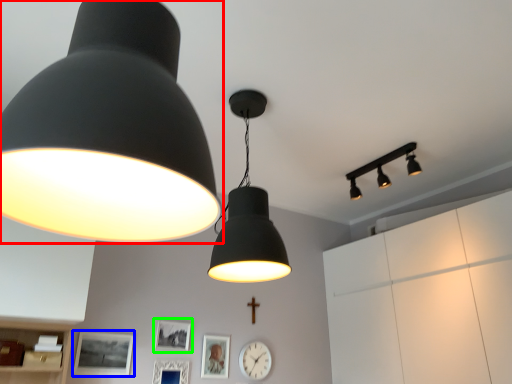
Question: Based on their relative distances, which object is nearer to lamp (highlighted by a red box)? Choose from picture frame (highlighted by a blue box) and picture frame (highlighted by a green box).

Choices:
 (A) picture frame
 (B) picture frame

Answer: (A)